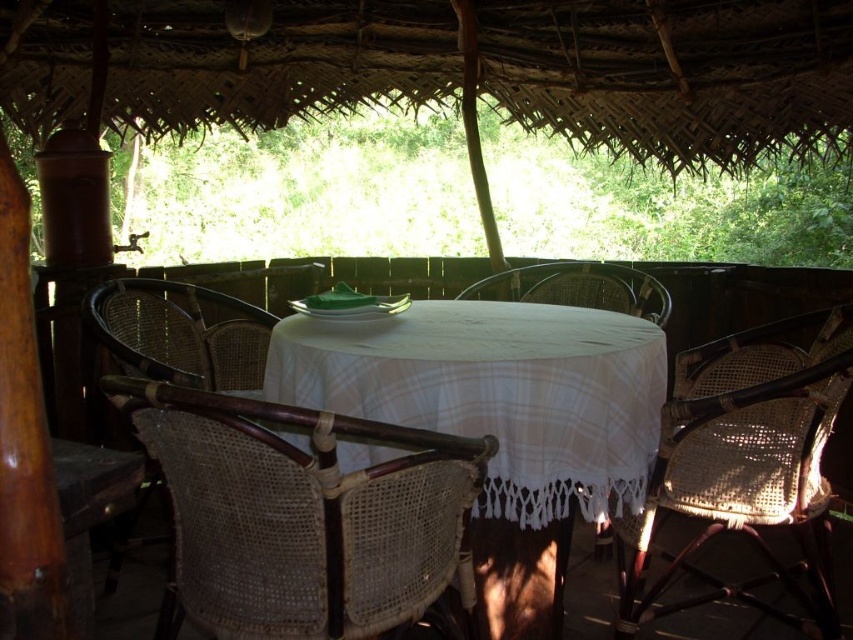
You are a guest at the lodge and want to sit down for dinner. You see the woven cane chair at center and the woven cane chair at lower right. Which chair is closer to the table?

Both the woven cane chair at center and the woven cane chair at lower right are 34.47 inches apart from each other, so they are equidistant from the table.

You are sitting at the table and want to move to the chair that is to the left of the other chair. Which chair should you choose between the woven cane chair at center and the woven rattan chair at left?

You should choose the woven rattan chair at left because the woven cane chair at center is to the right of the woven rattan chair at left, so the woven rattan chair at left is on the left side.